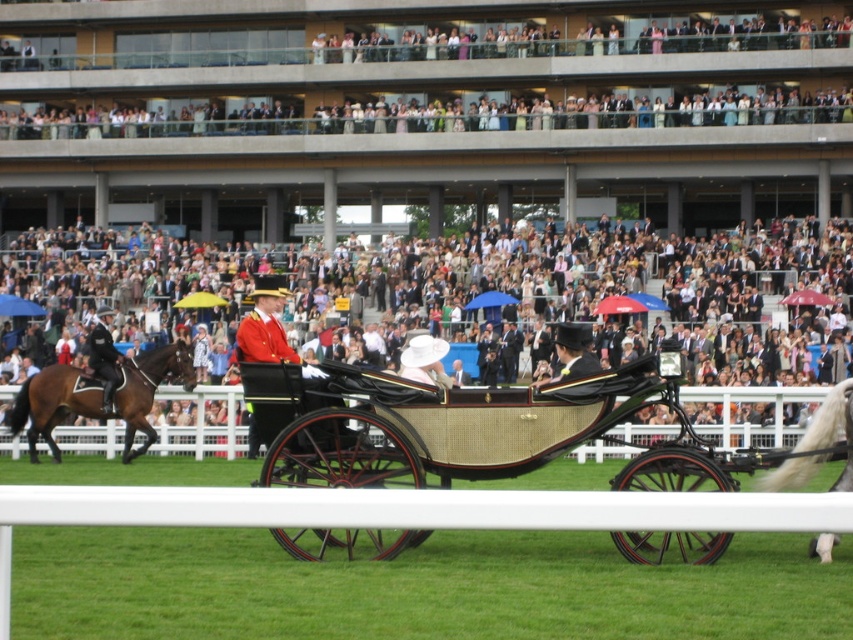
Between white silky horse at right and shiny black uniform at left, which one has more height?

shiny black uniform at left

Can you confirm if white silky horse at right is smaller than shiny black uniform at left?

Yes.

Is point (846, 406) positioned after point (120, 384)?

No, (846, 406) is in front of (120, 384).

Locate an element on the screen. The image size is (853, 640). white silky horse at right is located at coordinates (817, 444).

Based on the photo, is rattan/wooden wagon at center thinner than brown glossy horse at left?

No.

Who is more distant from viewer, [346,440] or [49,385]?

The point [49,385] is behind.

Does point (428, 412) come in front of point (38, 401)?

Yes, point (428, 412) is in front of point (38, 401).

This screenshot has height=640, width=853. I want to click on rattan/wooden wagon at center, so 473,429.

Consider the image. Between rattan/wooden wagon at center and white silky horse at right, which one has more height?

white silky horse at right is taller.

Is rattan/wooden wagon at center to the right of white silky horse at right from the viewer's perspective?

No, rattan/wooden wagon at center is not to the right of white silky horse at right.

This screenshot has height=640, width=853. What do you see at coordinates (473, 429) in the screenshot?
I see `rattan/wooden wagon at center` at bounding box center [473, 429].

Locate an element on the screen. rattan/wooden wagon at center is located at coordinates pyautogui.click(x=473, y=429).